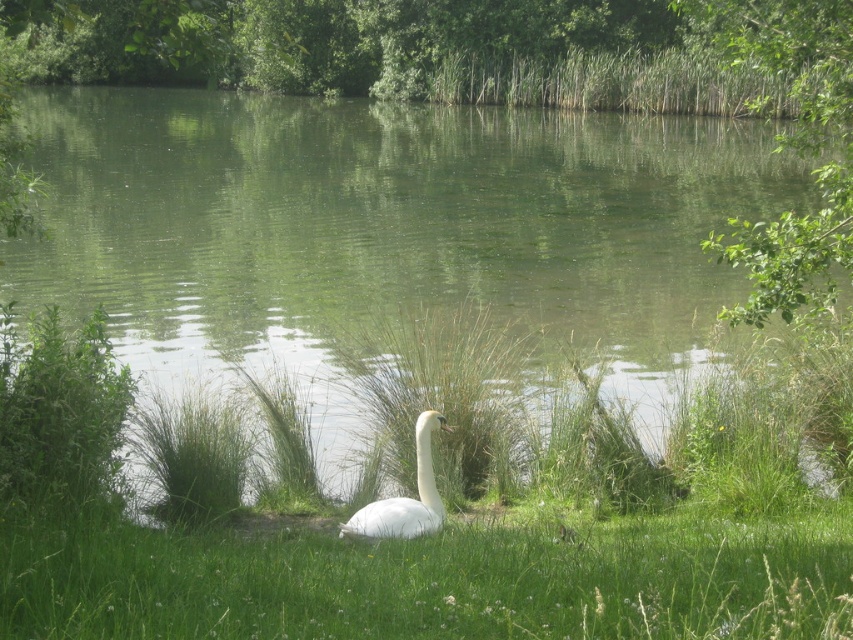
Question: Can you confirm if green water at center is smaller than green grass at center?

Choices:
 (A) yes
 (B) no

Answer: (B)

Question: Does green water at center have a smaller size compared to white feathered swan at center?

Choices:
 (A) yes
 (B) no

Answer: (B)

Question: Does green water at center appear on the left side of green grass at center?

Choices:
 (A) yes
 (B) no

Answer: (A)

Question: Which point is closer to the camera?

Choices:
 (A) tap(57, 336)
 (B) tap(413, 177)

Answer: (A)

Question: Which point is closer to the camera taking this photo?

Choices:
 (A) (676, 614)
 (B) (701, 307)

Answer: (A)

Question: Which point is closer to the camera?

Choices:
 (A) green grass at center
 (B) green water at center

Answer: (A)